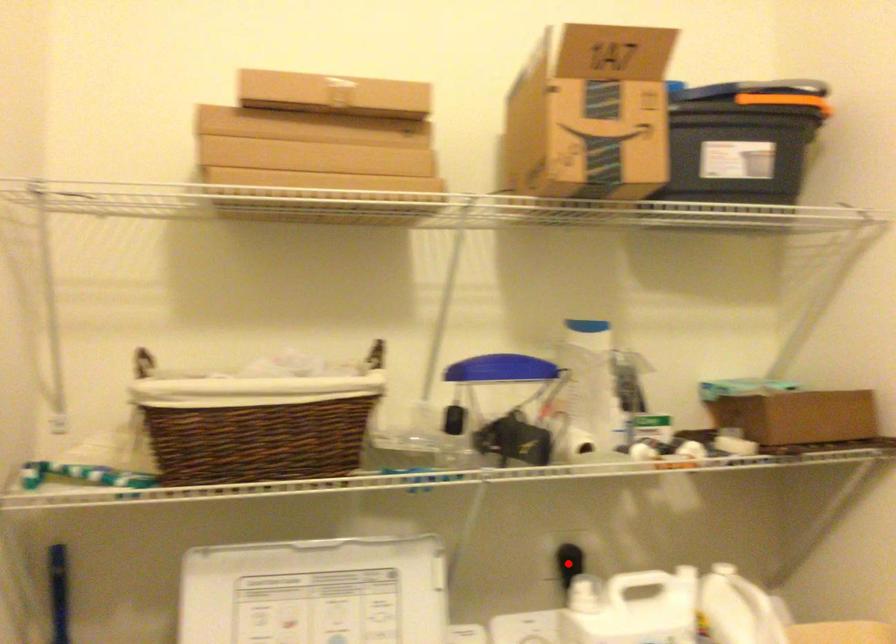
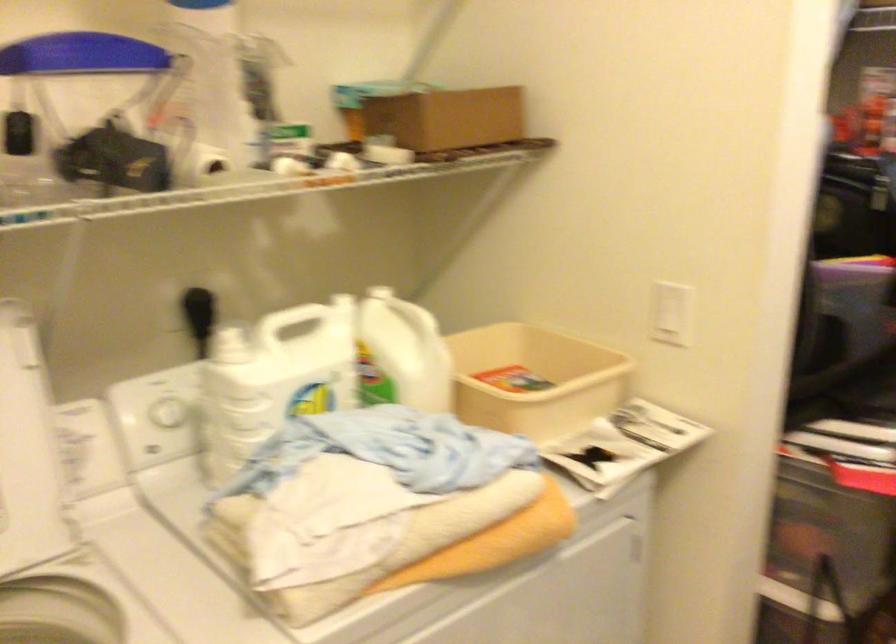
Find the pixel in the second image that matches the highlighted location in the first image.

(197, 303)